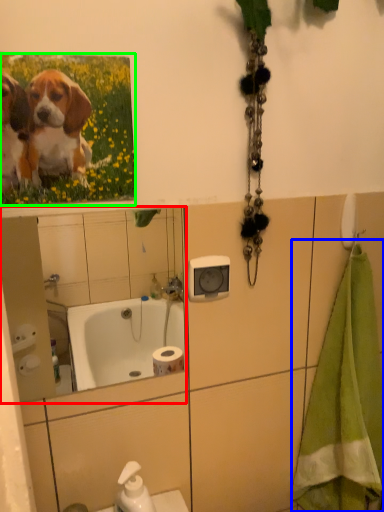
Question: Which object is positioned closest to mirror (highlighted by a red box)? Select from bath towel (highlighted by a blue box) and flower (highlighted by a green box).

Choices:
 (A) bath towel
 (B) flower

Answer: (A)